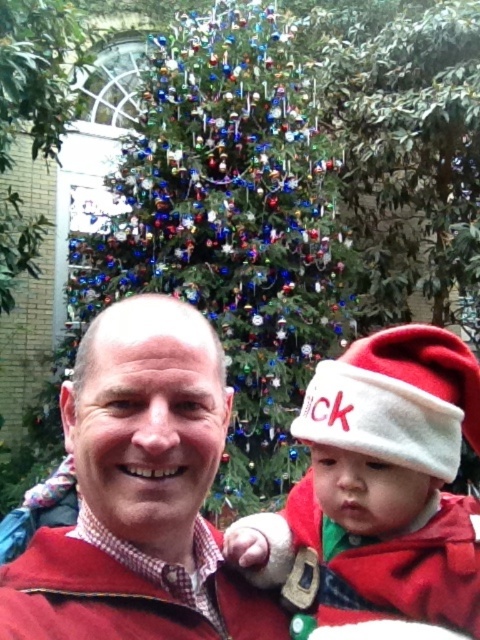
You are a photographer trying to capture a closeup of the shiny multicolored ornaments at center and the maroon fleece jacket at center. Which object should you zoom in on to get a clearer image of both without moving the camera?

The shiny multicolored ornaments at center is larger in size than the maroon fleece jacket at center, so you should zoom in on the shiny multicolored ornaments at center to ensure both objects are in focus and clearly visible.

Based on the scene description, what is the 2D coordinate of the shiny multicolored ornaments at center?

The 2D coordinate of the shiny multicolored ornaments at center is at point (x=235, y=221).